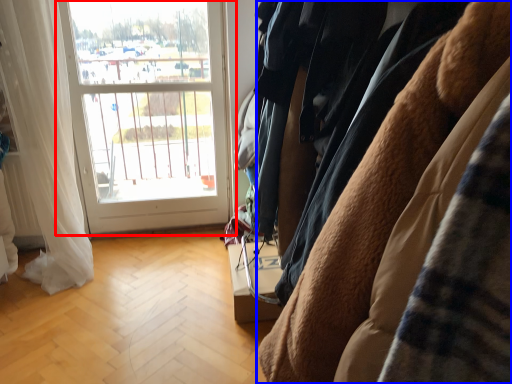
Question: Which object is further to the camera taking this photo, window (highlighted by a red box) or furniture (highlighted by a blue box)?

Choices:
 (A) window
 (B) furniture

Answer: (A)